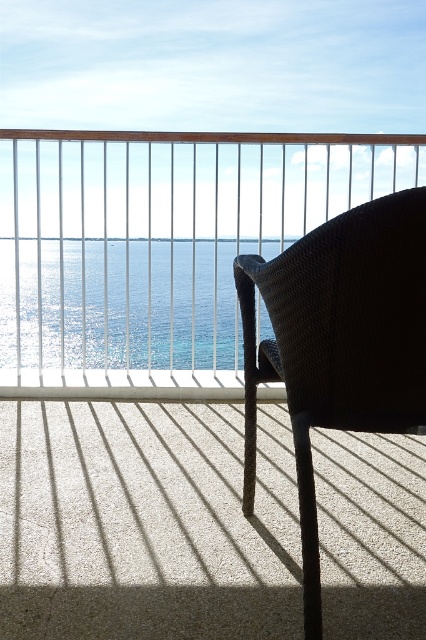
You are standing on the balcony and want to place a tall potted plant next to the woven dark brown armchair at right. Based on the scene, can the potted plant be placed there without blocking the view of the shiny blue water at center?

The woven dark brown armchair at right is shorter than the shiny blue water at center, so placing a tall potted plant next to it might block the view of the shiny blue water at center depending on the plant height. However, since the chair itself is shorter than the water, the plant would need to be shorter than the water to avoid obstruction. But since the water is likely at ground level and the plant would be on the balcony, this might not be possible. Therefore, it is safer to assume placing a tall plant

You are a painter who wants to paint the scene on the balcony. You have a canvas that can only fit objects of a certain size. Given that the matte wicker chair at center and the shiny blue water at center are both in your view, which object would you need to adjust the scale of to ensure it fits on your canvas?

The matte wicker chair at center has a smaller size compared to shiny blue water at center. Since the shiny blue water at center is larger, you would need to reduce its scale to fit both objects on the canvas.